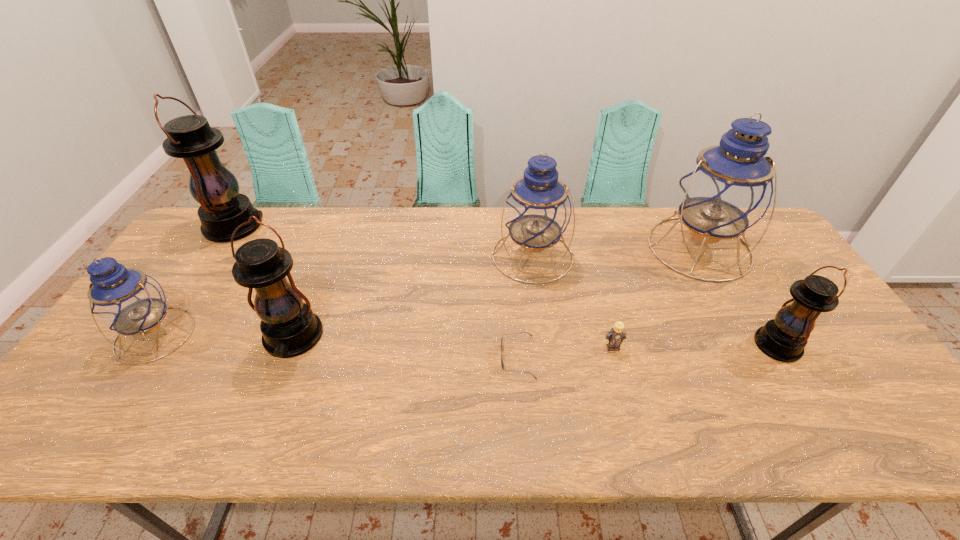
Where is `vacant region at the right edge`? This screenshot has width=960, height=540. vacant region at the right edge is located at coordinates (860, 371).

Where is `vacant space at the far right corner of the desktop`? The height and width of the screenshot is (540, 960). vacant space at the far right corner of the desktop is located at coordinates (756, 227).

Where is `free spot between the second biggest blue lantern and the second black lantern from right to left`? The image size is (960, 540). free spot between the second biggest blue lantern and the second black lantern from right to left is located at coordinates (413, 296).

You are a GUI agent. You are given a task and a screenshot of the screen. Output one action in this format:
    pyautogui.click(x=<x>, y=<y>)
    Task: Click on the vacant area that lies between the sunglasses and the sixth object from left to right
    
    Given the screenshot: What is the action you would take?
    pyautogui.click(x=564, y=353)

Image resolution: width=960 pixels, height=540 pixels. Identify the location of vacant region between the second black lantern from right to left and the rightmost black lantern. (535, 341).

Where is `free space between the third object from left to right and the fourth lantern from left to right`? This screenshot has width=960, height=540. free space between the third object from left to right and the fourth lantern from left to right is located at coordinates point(413,296).

Image resolution: width=960 pixels, height=540 pixels. I want to click on blank region between the second smallest blue lantern and the biggest black lantern, so click(x=384, y=241).

The height and width of the screenshot is (540, 960). Find the location of `free space between the second black lantern from right to left and the second smallest blue lantern`. free space between the second black lantern from right to left and the second smallest blue lantern is located at coordinates coord(413,296).

The image size is (960, 540). I want to click on free space between the smallest black lantern and the third object from right to left, so tap(694, 346).

The height and width of the screenshot is (540, 960). Find the location of `empty space between the rightmost black lantern and the rightmost blue lantern`. empty space between the rightmost black lantern and the rightmost blue lantern is located at coordinates (737, 296).